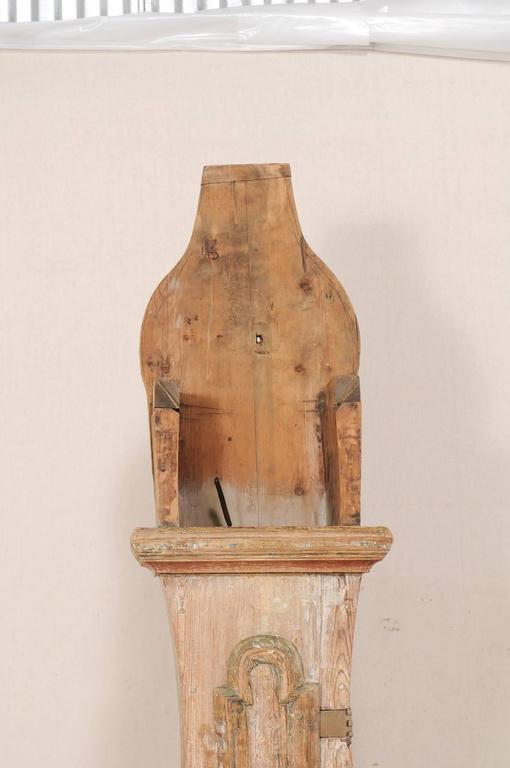
Locate an element on the screen. place to open wooden door is located at coordinates (233, 736).